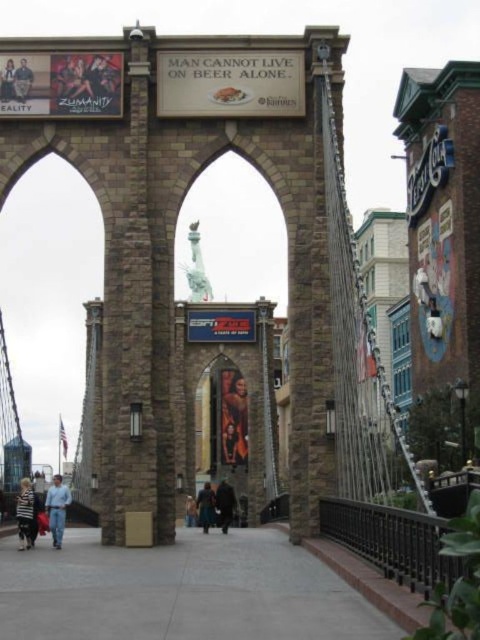
Question: Is blue jeans at lower left to the left of striped fabric jacket at lower left from the viewer's perspective?

Choices:
 (A) yes
 (B) no

Answer: (A)

Question: Which of the following is the closest to the observer?

Choices:
 (A) smooth black hair at upper left
 (B) gray concrete pavement at center
 (C) smooth skin face at upper left
 (D) blue jeans at lower left

Answer: (B)

Question: Among these points, which one is nearest to the camera?

Choices:
 (A) (173, 561)
 (B) (203, 497)
 (C) (60, 541)
 (D) (24, 93)

Answer: (A)

Question: Observing the image, what is the correct spatial positioning of striped fabric jacket at lower left in reference to dark brown leather coat at center?

Choices:
 (A) above
 (B) below

Answer: (A)

Question: Considering the real-world distances, which object is farthest from the smooth skin face at upper left?

Choices:
 (A) gray concrete pavement at center
 (B) striped fabric jacket at lower left
 (C) smooth black hair at upper left
 (D) brown leather jacket at center

Answer: (D)

Question: Does gray concrete pavement at center appear over striped fabric jacket at lower left?

Choices:
 (A) yes
 (B) no

Answer: (B)